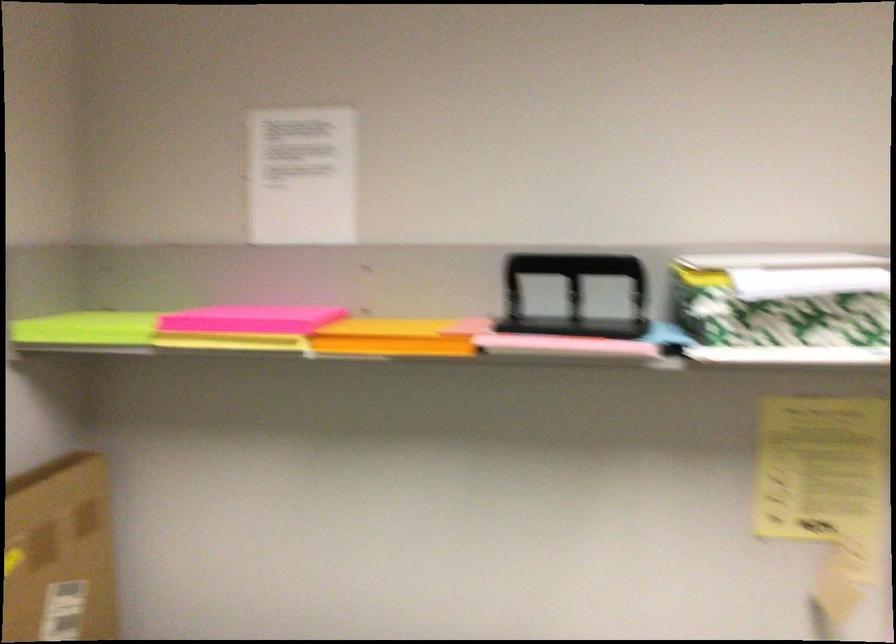
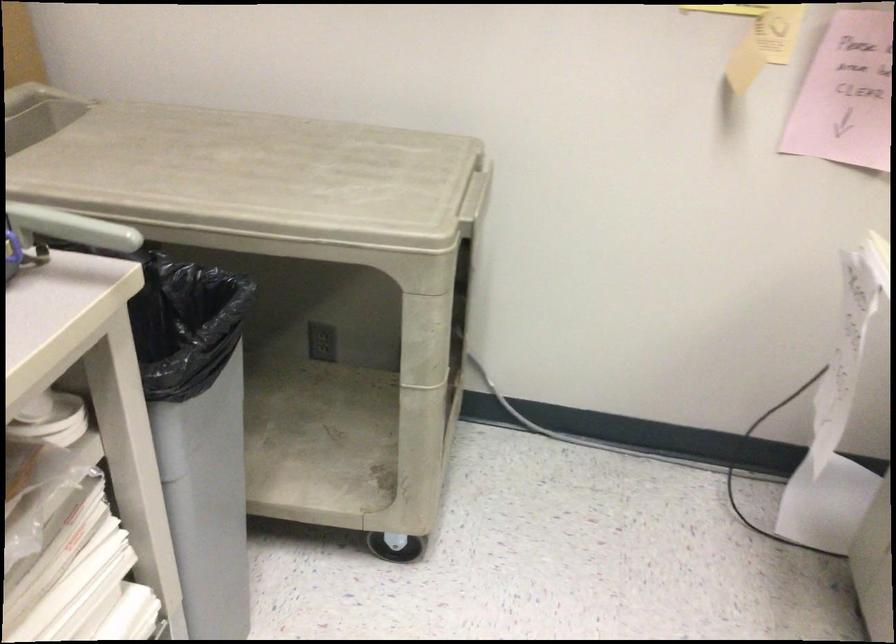
Question: What movement of the cameraman would produce the second image?

Choices:
 (A) Left
 (B) Right
 (C) Forward
 (D) Backward

Answer: (D)